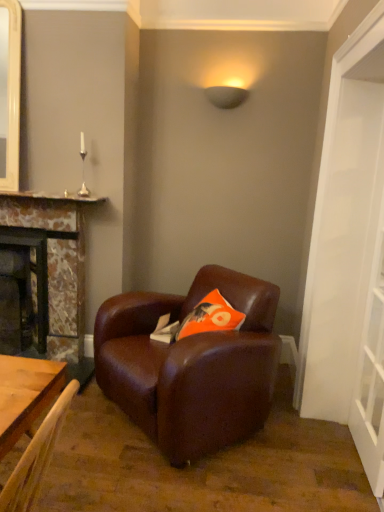
At what (x,y) coordinates should I click in order to perform the action: click on empty space that is ontop of matte black lampshade at upper center (from a real-world perspective). Please return your answer as a coordinate pair (x, y). The height and width of the screenshot is (512, 384). Looking at the image, I should click on (231, 86).